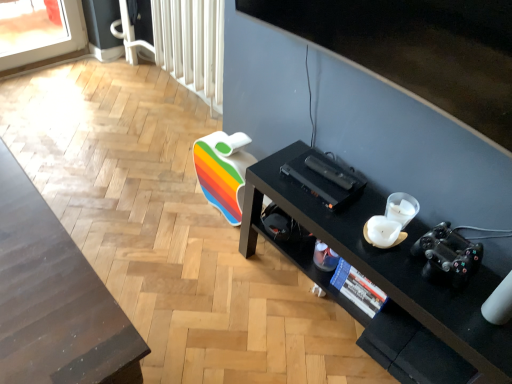
This screenshot has height=384, width=512. What are the coordinates of `free space to the left of black matte video camera at lower right` in the screenshot? It's located at (376, 254).